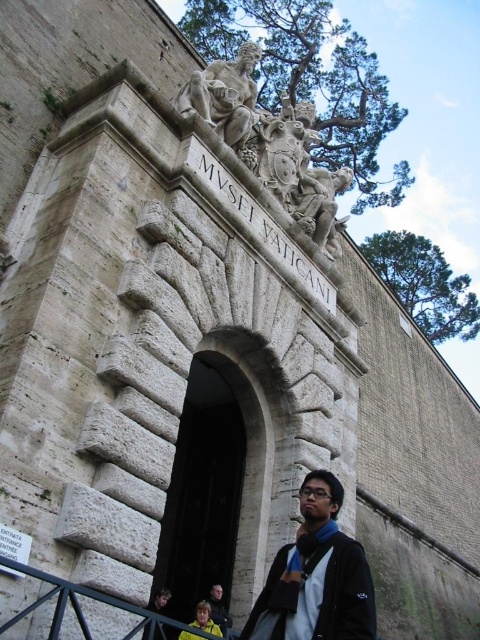
Question: Can you confirm if matte black jacket at lower center is positioned below yellow fabric at lower center?

Choices:
 (A) yes
 (B) no

Answer: (B)

Question: Can you confirm if stone archway at center is positioned above yellow fabric at lower center?

Choices:
 (A) no
 (B) yes

Answer: (B)

Question: Which point is closer to the camera?

Choices:
 (A) (228, 125)
 (B) (241, 412)

Answer: (B)

Question: Does white stone sculpture at upper center have a larger size compared to white stone statue at upper center?

Choices:
 (A) yes
 (B) no

Answer: (A)

Question: Which point is farther to the camera?

Choices:
 (A) stone archway at center
 (B) white stone statue at upper center

Answer: (B)

Question: Which of the following is the closest to the observer?

Choices:
 (A) (222, 609)
 (B) (252, 97)
 (C) (228, 408)
 (D) (233, 141)

Answer: (A)